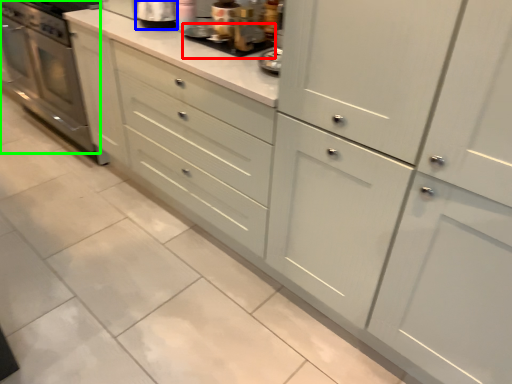
Question: Estimate the real-world distances between objects in this image. Which object is farther from appliance (highlighted by a red box), appliance (highlighted by a blue box) or home appliance (highlighted by a green box)?

Choices:
 (A) appliance
 (B) home appliance

Answer: (B)